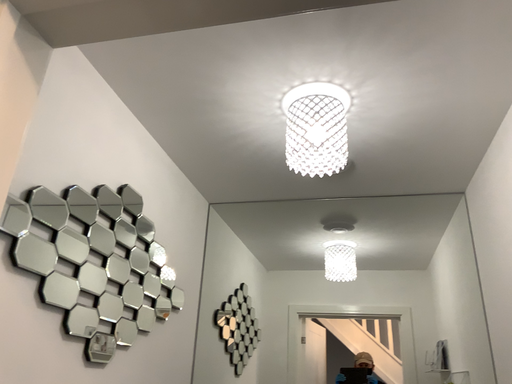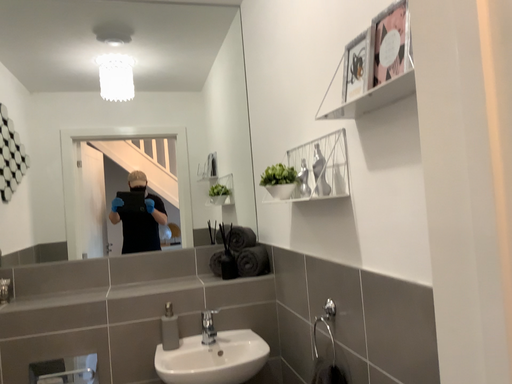
Question: Which way did the camera rotate in the video?

Choices:
 (A) rotated right
 (B) rotated left

Answer: (A)